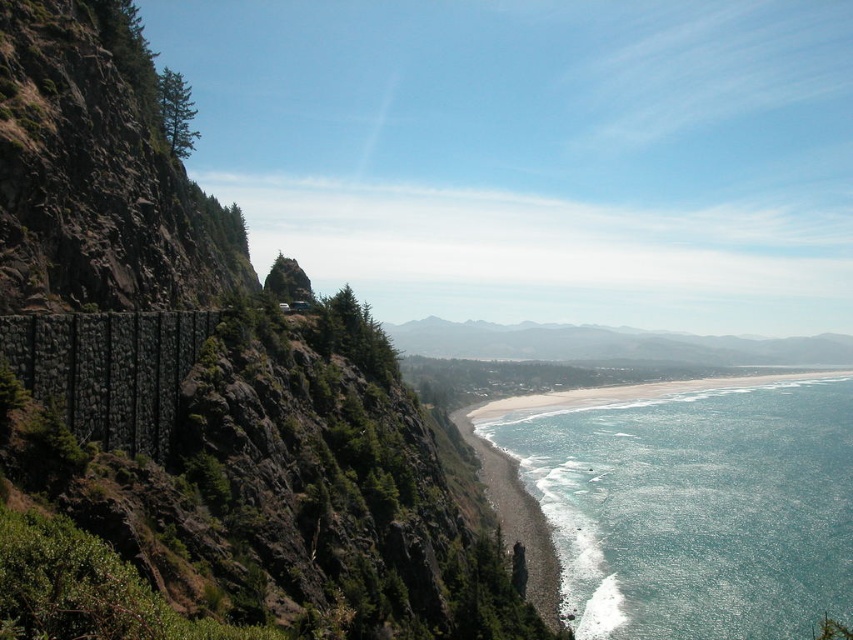
Can you confirm if rocky cliff at left is thinner than smooth sand beach at lower center?

Correct, rocky cliff at left's width is less than smooth sand beach at lower center's.

Does rocky cliff at left have a larger size compared to smooth sand beach at lower center?

No.

Who is more forward, (x=126, y=88) or (x=462, y=412)?

Point (x=126, y=88) is in front.

Locate an element on the screen. rocky cliff at left is located at coordinates (260, 468).

Which of these two, rocky cliff at left or blue-green water at lower center, stands shorter?

blue-green water at lower center

In the scene shown: Is rocky cliff at left thinner than blue-green water at lower center?

Correct, rocky cliff at left's width is less than blue-green water at lower center's.

Between point (408, 436) and point (764, 392), which one is positioned in front?

Point (408, 436)

Image resolution: width=853 pixels, height=640 pixels. What are the coordinates of `rocky cliff at left` in the screenshot? It's located at (260, 468).

Is blue-green water at lower center to the right of smooth sand beach at lower center from the viewer's perspective?

Indeed, blue-green water at lower center is positioned on the right side of smooth sand beach at lower center.

Is point (578, 528) behind point (498, 502)?

No, it is in front of (498, 502).

At what (x,y) coordinates should I click in order to perform the action: click on blue-green water at lower center. Please return your answer as a coordinate pair (x, y). Looking at the image, I should click on (695, 506).